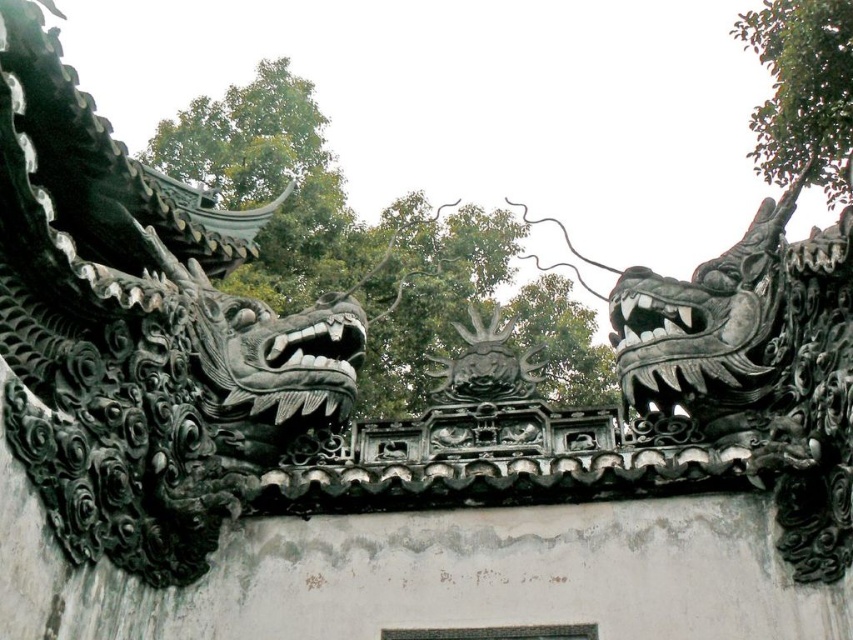
You are an architect designing a replica of this East Asian roof structure. You need to ensure that the black stone dragon head at upper right and the black matte dragon head at center are proportionate. Based on the image, which dragon head should be placed higher to maintain the design balance?

The black stone dragon head at upper right should be placed higher than the black matte dragon head at center to maintain the design balance, as it is much taller according to the description.